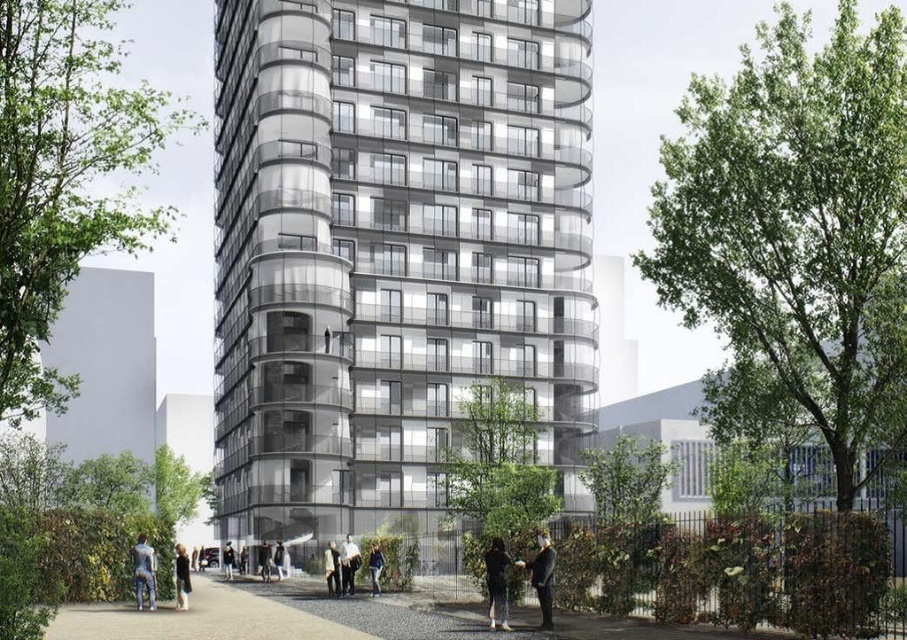
You are standing on the pathway and want to greet both the person wearing the dark gray fabric jacket at lower left and the person wearing the light brown leather jacket at center. Which jacket should you approach first to reach the closer one?

You should approach the dark gray fabric jacket at lower left first because it is closer to you than the light brown leather jacket at center.

You are a delivery person carrying a package and need to move from the dark gray fabric jacket at lower center to the dark gray fabric jacket at lower left. The path between them is 9.80 meters long. Can you safely walk this distance while carrying your package?

Yes, the distance between the dark gray fabric jacket at lower center and the dark gray fabric jacket at lower left is 9.80 meters, which is a manageable distance for a delivery person to walk while carrying a package.